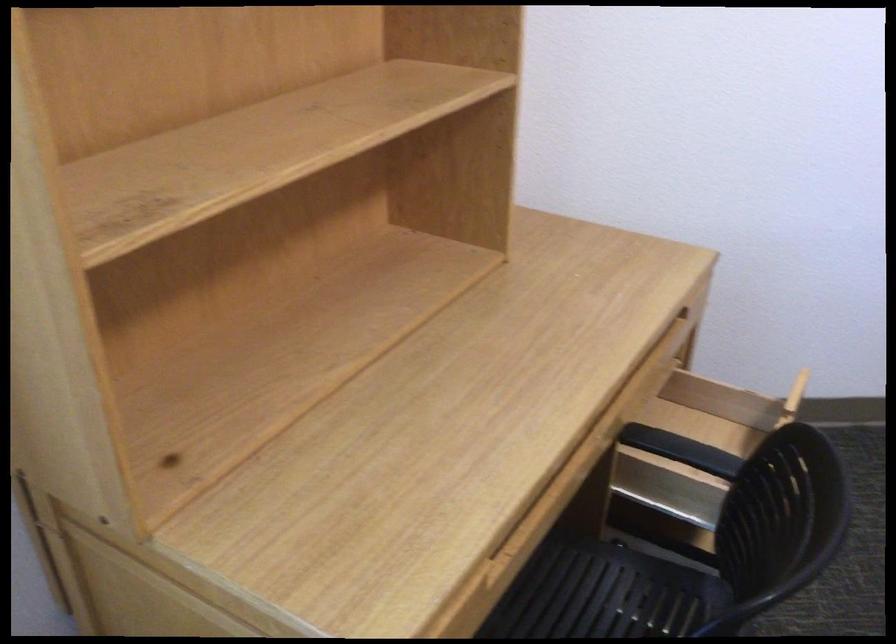
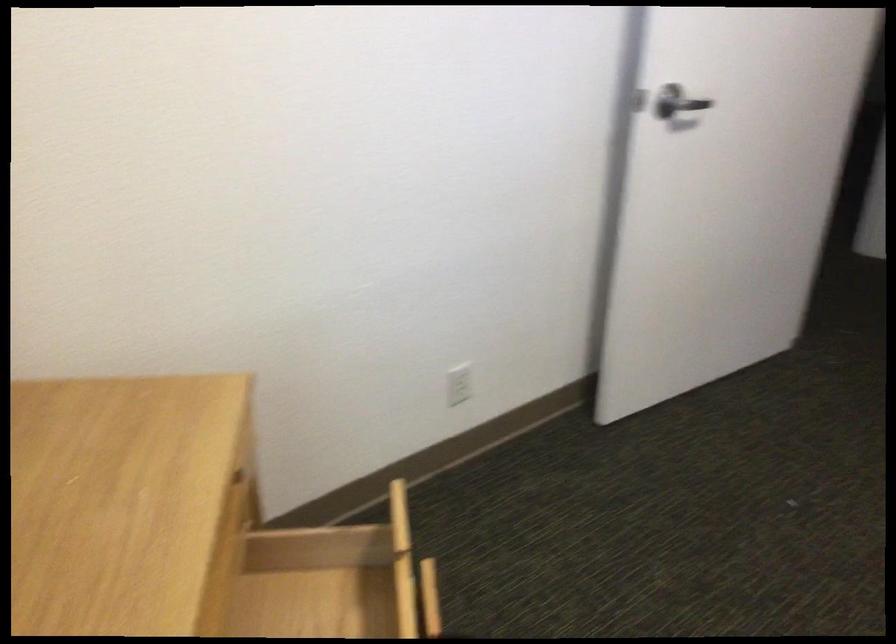
Question: The camera is either moving clockwise (left) or counter-clockwise (right) around the object. The first image is from the beginning of the video and the second image is from the end. Is the camera moving left or right when shooting the video?

Choices:
 (A) Left
 (B) Right

Answer: (A)